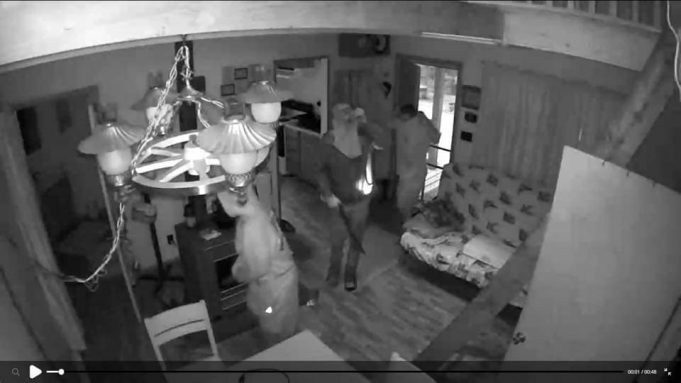
The image size is (681, 383). What are the coordinates of `table` in the screenshot? It's located at (298, 343).